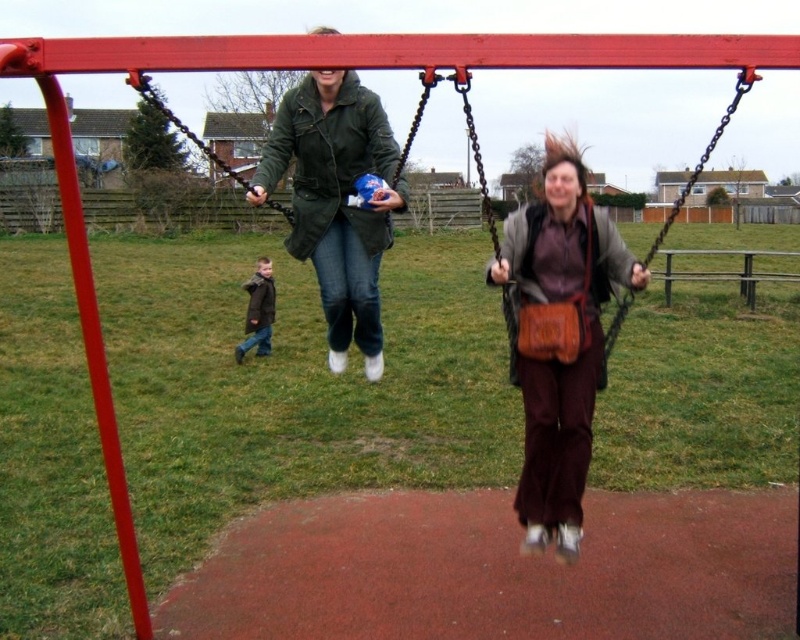
You are a security guard at the playground and need to ensure that the brown leather purse at center and the green matte jacket at center are not left unattended. Which object should you prioritize securing first if you can only handle one at a time, considering their sizes?

The brown leather purse at center has a larger size compared to the green matte jacket at center, so you should prioritize securing the brown leather purse at center first since it is more noticeable and harder to keep track of due to its size.

You are a photographer trying to capture a closeup shot of the green matte jacket at center and the brown leather bag at center. Since you want to focus on the smaller object, which one should you point your camera at?

The green matte jacket at center has a lesser width compared to brown leather bag at center, so you should point your camera at the green matte jacket at center as it is the smaller object.

You are a security guard at the playground and need to check the items left behind. You see the brown leather purse at center and the green matte jacket at center. Which item is taller?

The brown leather purse at center is taller than the green matte jacket at center.